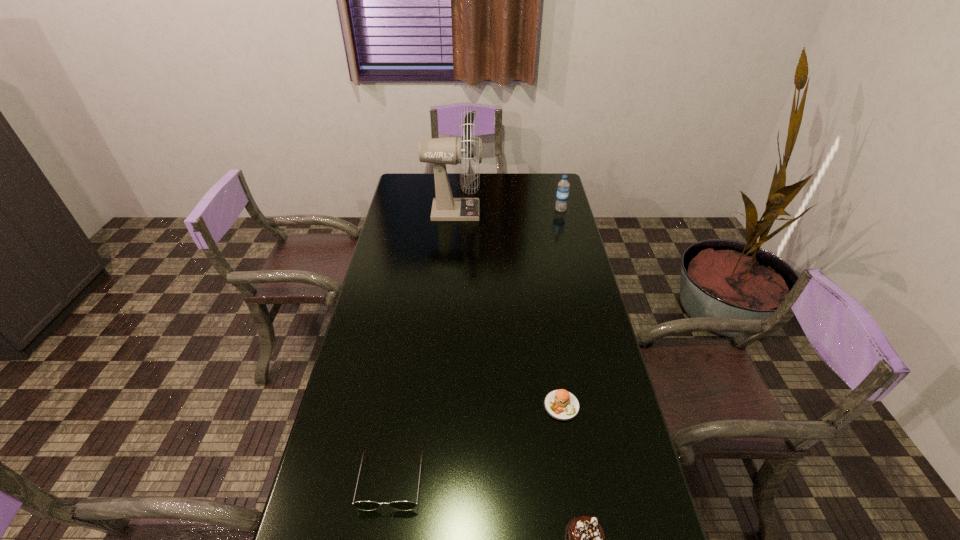
Identify the location of the tallest object. (441, 151).

The height and width of the screenshot is (540, 960). In order to click on the rightmost object in this screenshot , I will do `click(563, 189)`.

Find the location of a particular element. The image size is (960, 540). the second tallest object is located at coordinates (563, 189).

The height and width of the screenshot is (540, 960). What are the coordinates of `the second shortest object` in the screenshot? It's located at (361, 505).

Where is `the fourth farthest object`? This screenshot has width=960, height=540. the fourth farthest object is located at coordinates pyautogui.click(x=361, y=505).

Where is `patty`? The height and width of the screenshot is (540, 960). patty is located at coordinates (560, 404).

The height and width of the screenshot is (540, 960). Find the location of `the third farthest object`. the third farthest object is located at coordinates point(560,404).

This screenshot has width=960, height=540. I want to click on vacant space located 0.160m on the air flow direction of the fan, so click(x=517, y=211).

Locate an element on the screen. This screenshot has width=960, height=540. free location located 0.320m on the label of the rightmost object is located at coordinates (573, 258).

This screenshot has height=540, width=960. I want to click on vacant space located 0.050m on the right of the patty, so click(598, 406).